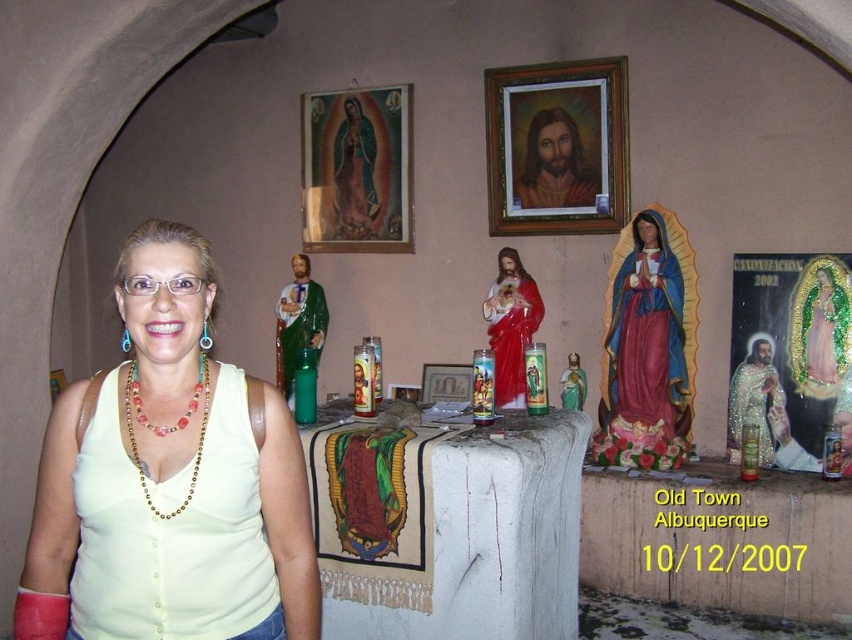
You are standing in front of the shrine and want to place a small offering between the matte gold jesus at upper center and the wooden picture frame at center. Which object should you place it to the left of to ensure it is between them?

You should place the offering to the left of the matte gold jesus at upper center. Since the matte gold jesus at upper center is to the right of the wooden picture frame at center, placing the offering to its left would position it between both objects.

You are a photographer setting up a tripod in the shrine. The wooden frame at upper center and the matte red statue at center are both in your shot. You want to ensure that the distance between them in your photo matches the actual distance of 26.80 inches. What should you do to maintain this distance in your composition?

Position the tripod so that the wooden frame at upper center and the matte red statue at center are spaced 26.80 inches apart in the frame, ensuring the camera captures their actual distance accurately.